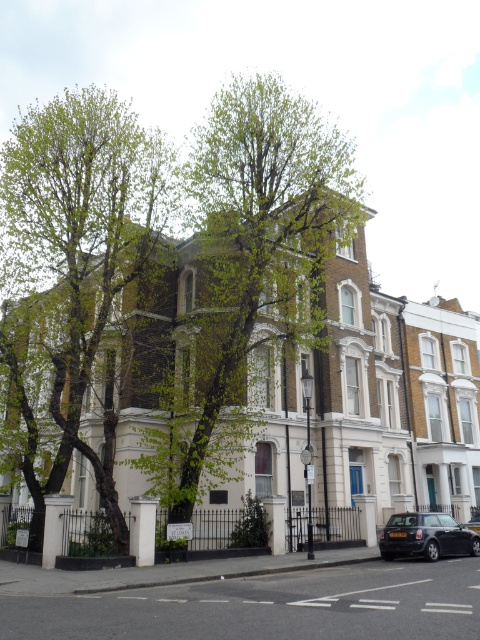
You are a pedestrian standing at the edge of the road and see the black matte car at lower right and the shiny black car at center. Which car is closer to you?

The shiny black car at center is closer to you because the black matte car at lower right is located above it, meaning it is further away in the scene.

You are standing in front of the row of buildings and want to take a photo of the shiny black car at center without the green leafy tree at left blocking it. Which direction should you move to ensure the tree is no longer in the frame?

Move to the right so that the green leafy tree at left is no longer blocking the shiny black car at center.

You are a delivery driver who needs to park your black matte car at lower right near the green leafy tree at left. Considering the space between them, can your car fit between the tree and the building behind it?

The green leafy tree at left is wider than the black matte car at lower right. Since the tree is wider, there might be sufficient space for the car to fit between the tree and the building, but the exact clearance depends on the tree trunk and branches. However, based on width alone, the car could potentially fit as it is narrower than the tree.